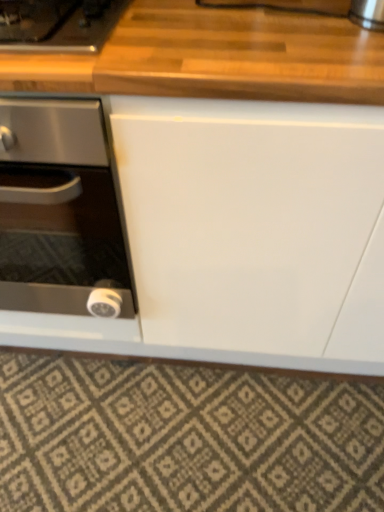
The image size is (384, 512). Identify the location of blank area beneath textured beige rug at lower center (from a real-world perspective). (186, 434).